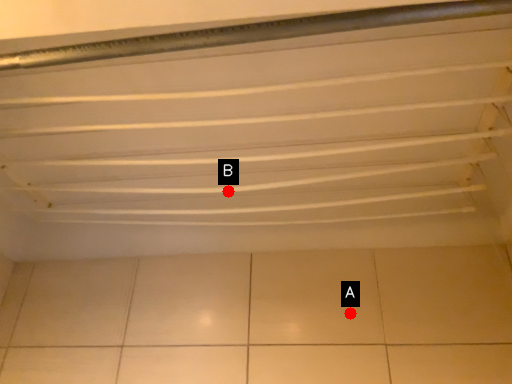
Question: Two points are circled on the image, labeled by A and B beside each circle. Which point is closer to the camera taking this photo?

Choices:
 (A) A is closer
 (B) B is closer

Answer: (A)